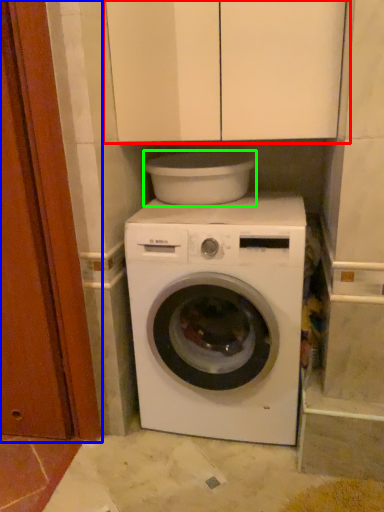
Question: Considering the real-world distances, which object is farthest from cabinetry (highlighted by a red box)? door (highlighted by a blue box) or appliance (highlighted by a green box)?

Choices:
 (A) door
 (B) appliance

Answer: (A)